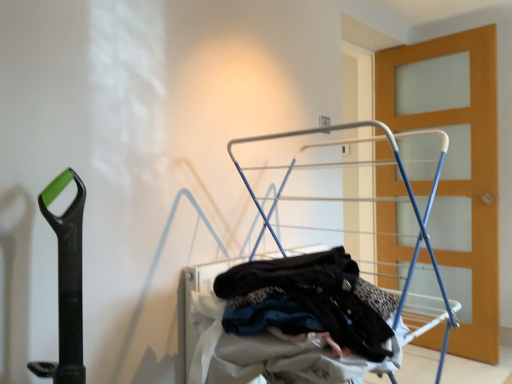
Question: Is the depth of wooden door at right greater than that of white metallic drying rack at center?

Choices:
 (A) yes
 (B) no

Answer: (A)

Question: Is white metallic drying rack at center surrounded by wooden door at right?

Choices:
 (A) no
 (B) yes

Answer: (A)

Question: Is wooden door at right positioned in front of white metallic drying rack at center?

Choices:
 (A) no
 (B) yes

Answer: (A)

Question: Can you confirm if wooden door at right is bigger than white metallic drying rack at center?

Choices:
 (A) no
 (B) yes

Answer: (A)

Question: Is wooden door at right aimed at white metallic drying rack at center?

Choices:
 (A) yes
 (B) no

Answer: (A)

Question: From the image's perspective, is wooden door at right below white metallic drying rack at center?

Choices:
 (A) no
 (B) yes

Answer: (A)

Question: Is white metallic drying rack at center taller than wooden door at right?

Choices:
 (A) no
 (B) yes

Answer: (A)

Question: Is white metallic drying rack at center outside wooden door at right?

Choices:
 (A) yes
 (B) no

Answer: (A)

Question: From the image's perspective, would you say white metallic drying rack at center is shown under wooden door at right?

Choices:
 (A) no
 (B) yes

Answer: (B)

Question: From a real-world perspective, does white metallic drying rack at center sit lower than wooden door at right?

Choices:
 (A) yes
 (B) no

Answer: (A)

Question: From the image's perspective, is white metallic drying rack at center over wooden door at right?

Choices:
 (A) yes
 (B) no

Answer: (B)

Question: Considering the relative sizes of white metallic drying rack at center and wooden door at right in the image provided, is white metallic drying rack at center bigger than wooden door at right?

Choices:
 (A) no
 (B) yes

Answer: (B)

Question: Is white metallic drying rack at center taller or shorter than wooden door at right?

Choices:
 (A) short
 (B) tall

Answer: (A)